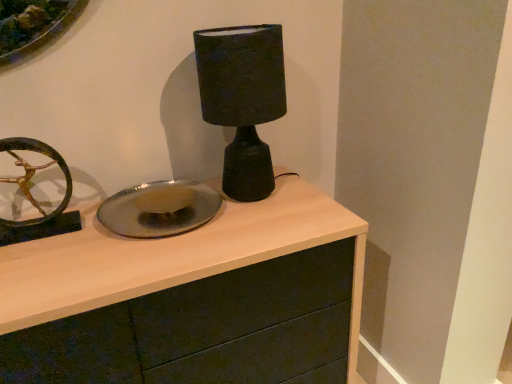
I want to click on free space in front of matte black lamp at center, so click(258, 230).